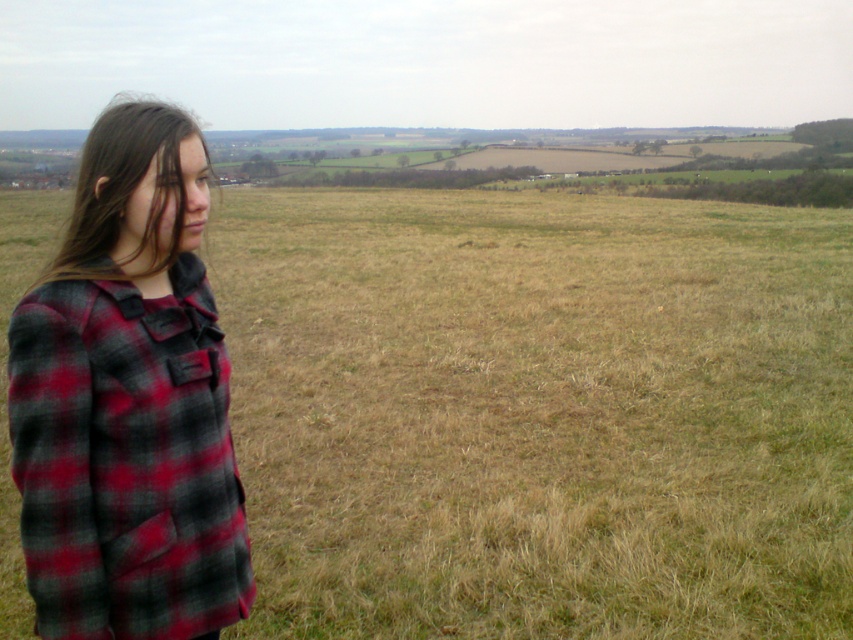
Question: Is brown dry grass at left closer to camera compared to red plaid jacket at left?

Choices:
 (A) yes
 (B) no

Answer: (B)

Question: Is brown dry grass at left to the right of red plaid jacket at left from the viewer's perspective?

Choices:
 (A) no
 (B) yes

Answer: (A)

Question: Among these objects, which one is farthest from the camera?

Choices:
 (A) red plaid jacket at left
 (B) brown dry grass at left

Answer: (B)

Question: Does brown dry grass at left appear on the left side of red plaid jacket at left?

Choices:
 (A) yes
 (B) no

Answer: (A)